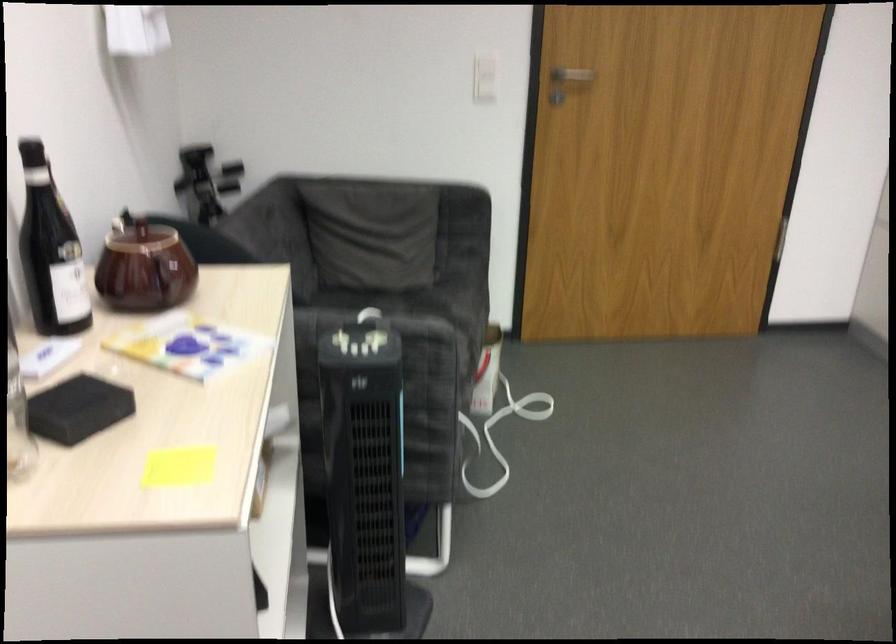
Find where to push the fan control buttons. Please return your answer as a coordinate pair (x, y).

(357, 339)